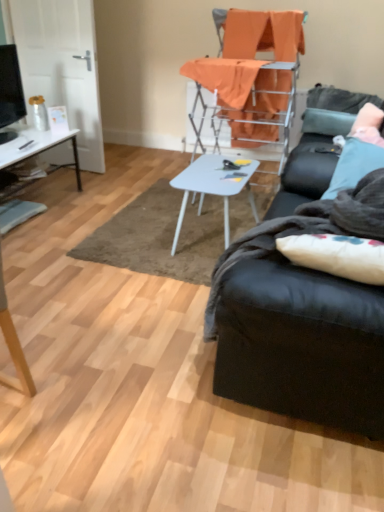
Question: Does black leather couch at right appear on the right side of white glossy desk at left?

Choices:
 (A) yes
 (B) no

Answer: (A)

Question: Is black leather couch at right positioned behind white glossy desk at left?

Choices:
 (A) yes
 (B) no

Answer: (B)

Question: Is white glossy desk at left surrounded by black leather couch at right?

Choices:
 (A) yes
 (B) no

Answer: (B)

Question: Is black leather couch at right shorter than white glossy desk at left?

Choices:
 (A) no
 (B) yes

Answer: (A)

Question: From the image's perspective, would you say black leather couch at right is positioned over white glossy desk at left?

Choices:
 (A) no
 (B) yes

Answer: (A)

Question: From a real-world perspective, is black leather couch at right below white glossy desk at left?

Choices:
 (A) no
 (B) yes

Answer: (A)

Question: Is the depth of white glossy table at center greater than that of matte black tv at left?

Choices:
 (A) no
 (B) yes

Answer: (A)

Question: From the image's perspective, is white glossy table at center beneath matte black tv at left?

Choices:
 (A) yes
 (B) no

Answer: (A)

Question: From a real-world perspective, is white glossy table at center located beneath matte black tv at left?

Choices:
 (A) no
 (B) yes

Answer: (B)

Question: Does white glossy table at center turn towards matte black tv at left?

Choices:
 (A) no
 (B) yes

Answer: (B)

Question: From a real-world perspective, is white glossy table at center located higher than matte black tv at left?

Choices:
 (A) no
 (B) yes

Answer: (A)

Question: Considering the relative sizes of white glossy table at center and matte black tv at left in the image provided, is white glossy table at center bigger than matte black tv at left?

Choices:
 (A) yes
 (B) no

Answer: (A)

Question: Can you confirm if white soft pillow at right is taller than matte black tv at left?

Choices:
 (A) yes
 (B) no

Answer: (B)